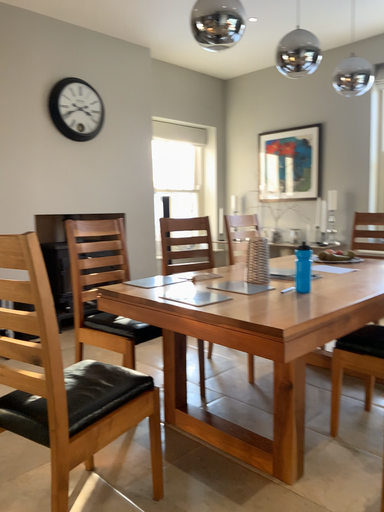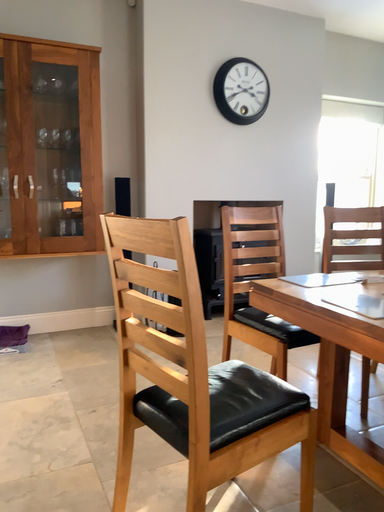
Question: Which way did the camera rotate in the video?

Choices:
 (A) rotated left
 (B) rotated right

Answer: (A)